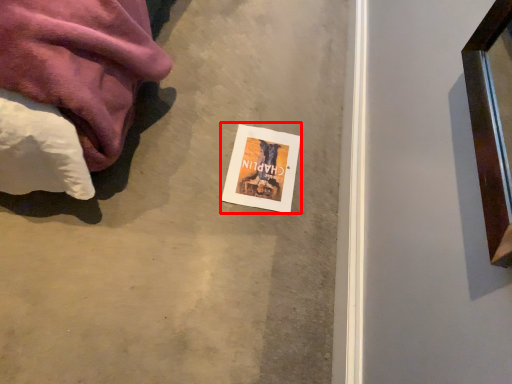
Question: Observing the image, what is the correct spatial positioning of flyer (annotated by the red box) in reference to concrete?

Choices:
 (A) left
 (B) right

Answer: (B)